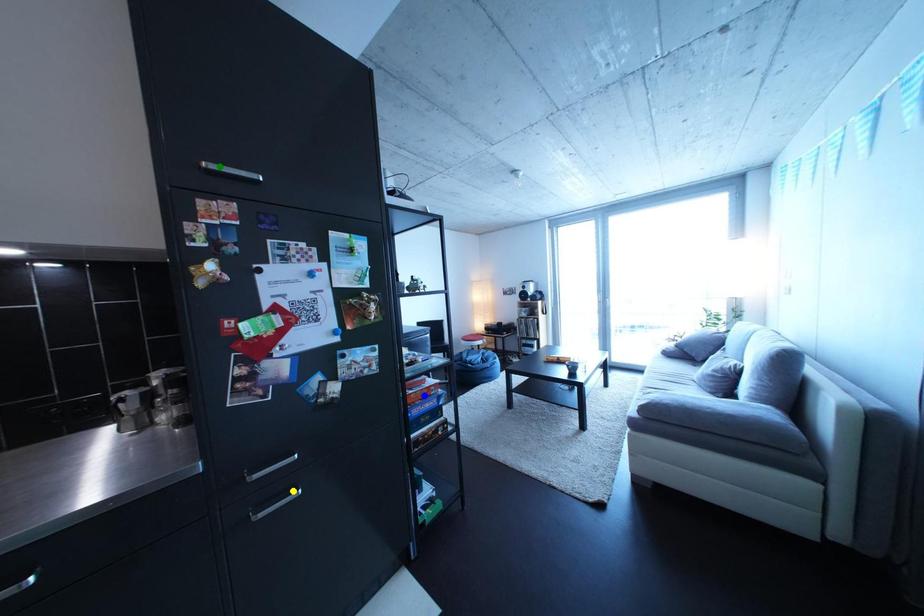
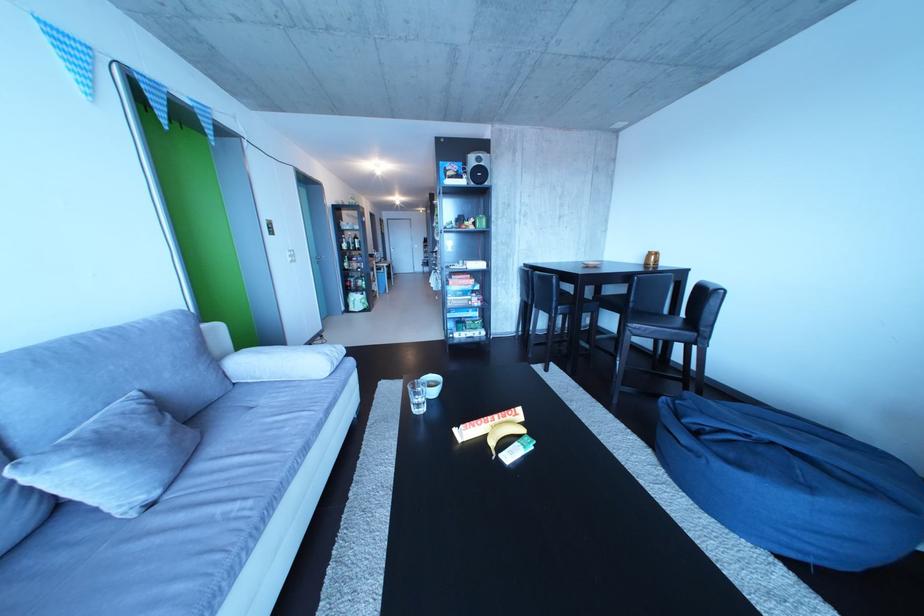
I am providing you with two images of the same scene from different viewpoints. Three points are marked in image1. Which point corresponds to a part or object that is occluded in image2?In image1, three points are marked. Which of them correspond to a part or object that is occluded in image2?Among the three points shown in image1, which one corresponds to a part or object that is no longer visible due to occlusion in image2?

Invisible in image2: blue point, green point, yellow point.